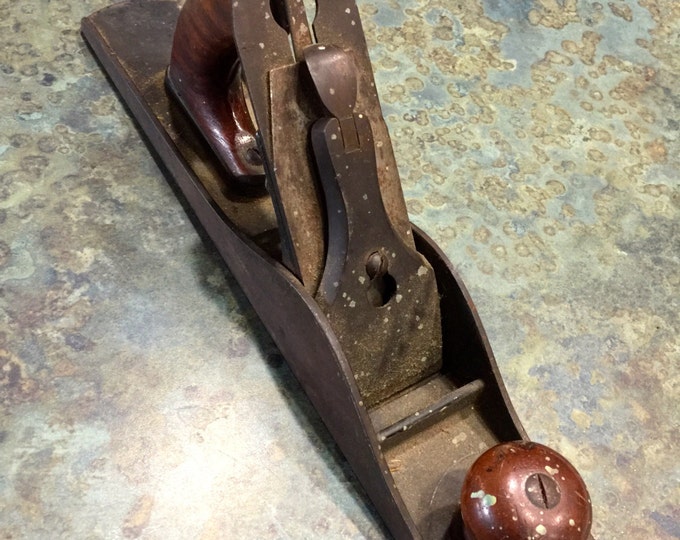
The width and height of the screenshot is (680, 540). I want to click on iron, so click(273, 54).